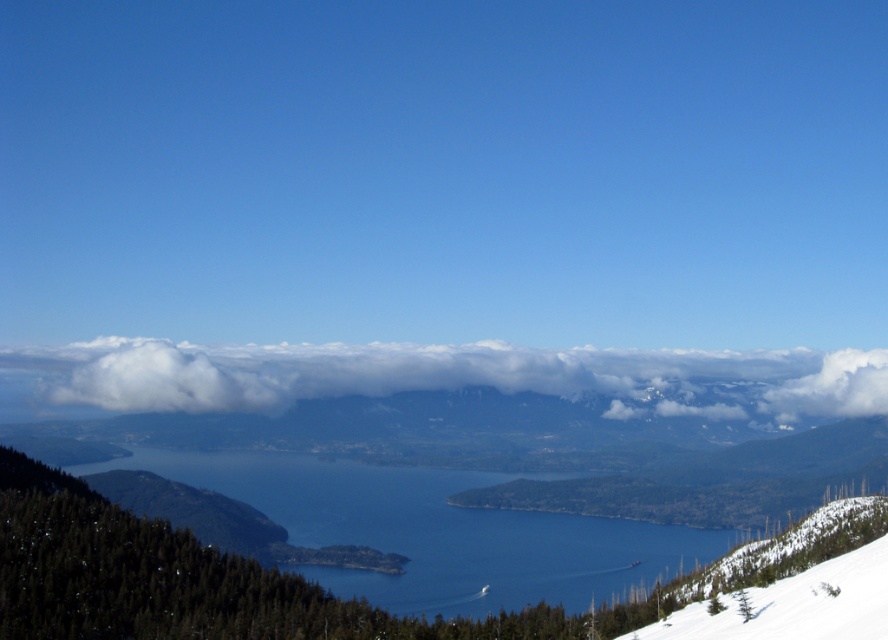
Which is more to the right, white fluffy cloud at upper center or blue water at center?

blue water at center

Looking at this image, who is lower down, white fluffy cloud at upper center or blue water at center?

blue water at center

Measure the distance between white fluffy cloud at upper center and camera.

white fluffy cloud at upper center is 1849.38 feet from camera.

This screenshot has width=888, height=640. In order to click on white fluffy cloud at upper center in this screenshot , I will do `click(437, 378)`.